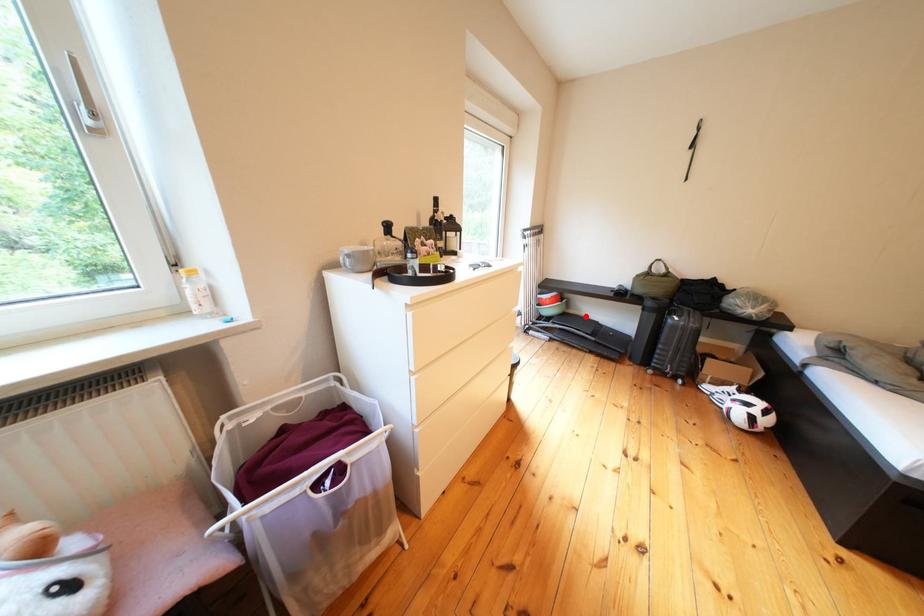
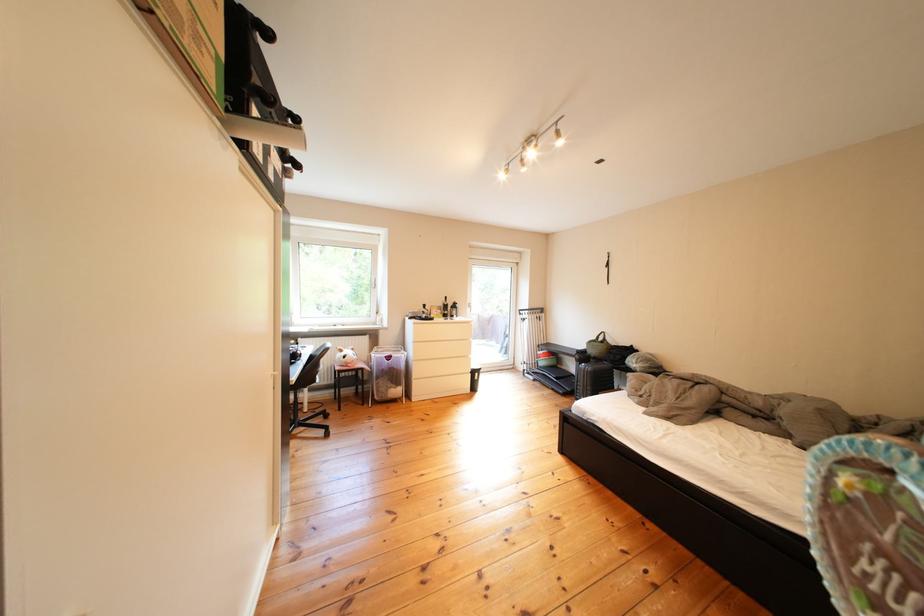
Question: I am providing you with two images of the same scene from different viewpoints. In image1, a red point is highlighted. Considering the same 3D point in image2, which of the following is correct?

Choices:
 (A) It is closer
 (B) It is farther

Answer: (B)